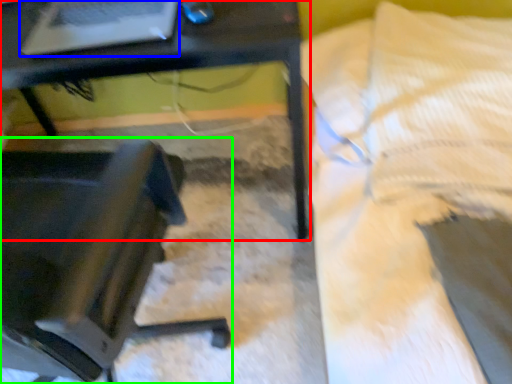
Question: Which is farther away from table (highlighted by a red box)? laptop (highlighted by a blue box) or chair (highlighted by a green box)?

Choices:
 (A) laptop
 (B) chair

Answer: (B)